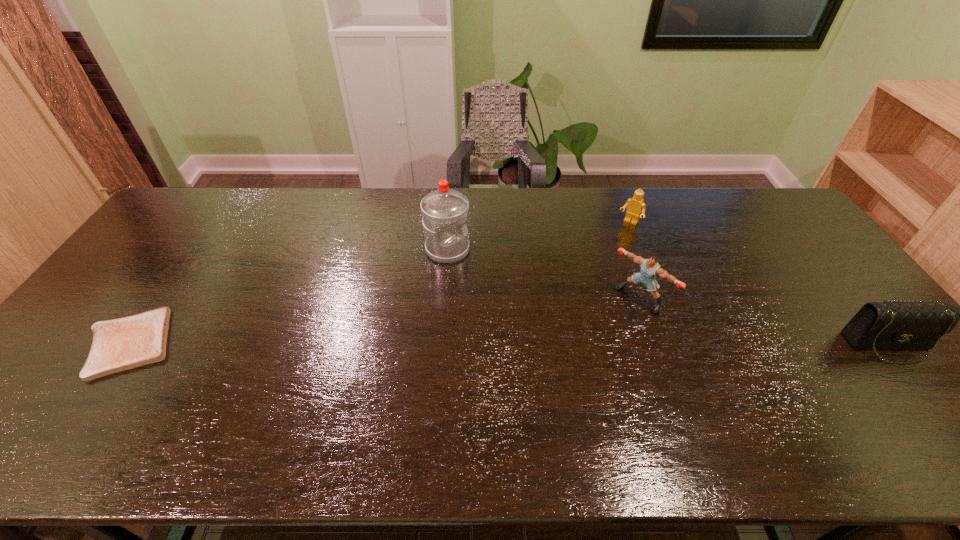
The width and height of the screenshot is (960, 540). Identify the location of vacant space that is in between the shortest object and the fourth shortest object. (384, 320).

The image size is (960, 540). I want to click on free area in between the puncher and the shortest object, so click(x=384, y=320).

Where is `unoccupied area between the puncher and the water bottle`? The image size is (960, 540). unoccupied area between the puncher and the water bottle is located at coordinates (543, 274).

The height and width of the screenshot is (540, 960). In order to click on free area in between the toast and the second tallest object in this screenshot , I will do `click(384, 320)`.

I want to click on unoccupied position between the tallest object and the shortest object, so click(x=288, y=296).

Identify the location of vacant area between the Lego and the clutch bag. (758, 284).

This screenshot has width=960, height=540. Find the location of `empty space that is in between the toast and the fourth shortest object`. empty space that is in between the toast and the fourth shortest object is located at coordinates (384, 320).

Identify the location of empty location between the second tallest object and the leftmost object. The height and width of the screenshot is (540, 960). [x=384, y=320].

In order to click on vacant area between the puncher and the toast in this screenshot , I will do `click(384, 320)`.

You are a GUI agent. You are given a task and a screenshot of the screen. Output one action in this format:
    pyautogui.click(x=<x>, y=<y>)
    Task: Click on the object that is the second closest to the fourth nearest object
    The height and width of the screenshot is (540, 960).
    Given the screenshot: What is the action you would take?
    pyautogui.click(x=635, y=205)